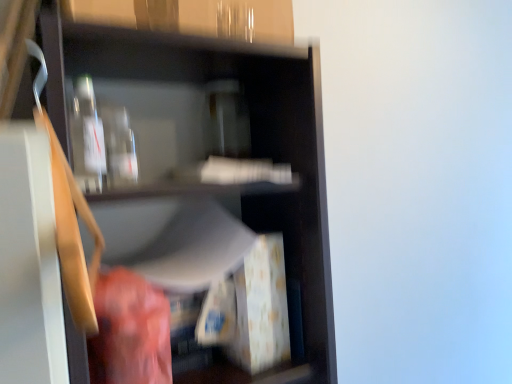
Question: From a real-world perspective, is matte black shelf at center beneath transparent glass bottle at upper left?

Choices:
 (A) yes
 (B) no

Answer: (A)

Question: Considering the relative positions of matte black shelf at center and transparent glass bottle at upper left in the image provided, is matte black shelf at center to the left of transparent glass bottle at upper left from the viewer's perspective?

Choices:
 (A) no
 (B) yes

Answer: (A)

Question: Is the position of matte black shelf at center more distant than that of transparent glass bottle at upper left?

Choices:
 (A) no
 (B) yes

Answer: (A)

Question: Can you confirm if matte black shelf at center is bigger than transparent glass bottle at upper left?

Choices:
 (A) no
 (B) yes

Answer: (B)

Question: Could you tell me if matte black shelf at center is turned towards transparent glass bottle at upper left?

Choices:
 (A) no
 (B) yes

Answer: (B)

Question: Is transparent glass bottle at upper left a part of matte black shelf at center?

Choices:
 (A) yes
 (B) no

Answer: (A)

Question: Does transparent glass bottle at upper left come behind matte black shelf at center?

Choices:
 (A) no
 (B) yes

Answer: (B)

Question: From the image's perspective, is transparent glass bottle at upper left located beneath matte black shelf at center?

Choices:
 (A) no
 (B) yes

Answer: (A)

Question: Is transparent glass bottle at upper left smaller than matte black shelf at center?

Choices:
 (A) no
 (B) yes

Answer: (B)

Question: Can you confirm if transparent glass bottle at upper left is bigger than matte black shelf at center?

Choices:
 (A) no
 (B) yes

Answer: (A)

Question: Would you consider transparent glass bottle at upper left to be distant from matte black shelf at center?

Choices:
 (A) yes
 (B) no

Answer: (B)

Question: From a real-world perspective, is transparent glass bottle at upper left physically below matte black shelf at center?

Choices:
 (A) yes
 (B) no

Answer: (B)

Question: Considering the relative sizes of transparent glass bottles at upper center and transparent glass bottle at upper left in the image provided, is transparent glass bottles at upper center smaller than transparent glass bottle at upper left?

Choices:
 (A) yes
 (B) no

Answer: (B)